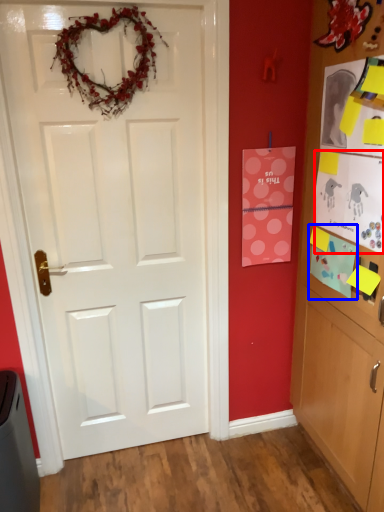
Question: Which of the following is the closest to the observer, postcard (highlighted by a red box) or postcard (highlighted by a blue box)?

Choices:
 (A) postcard
 (B) postcard

Answer: (A)